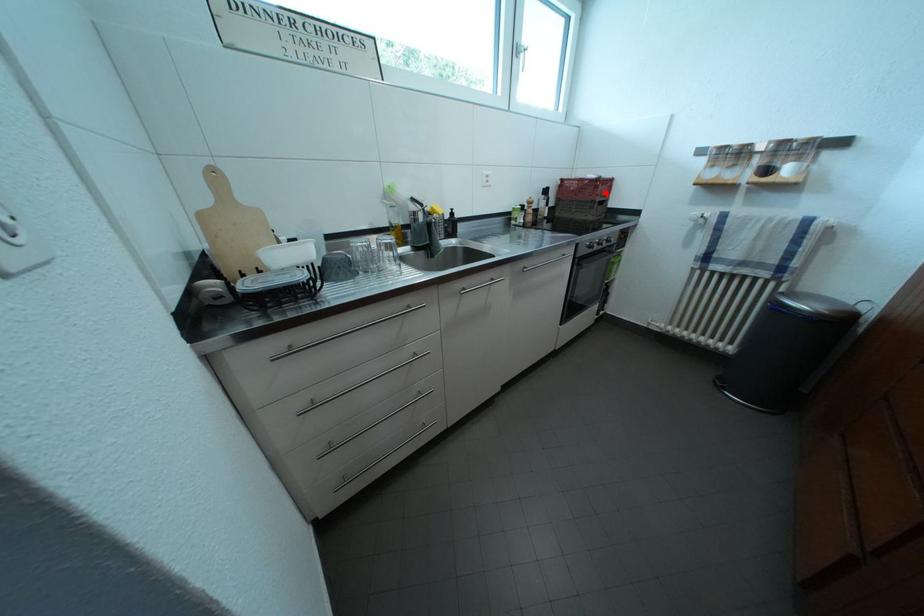
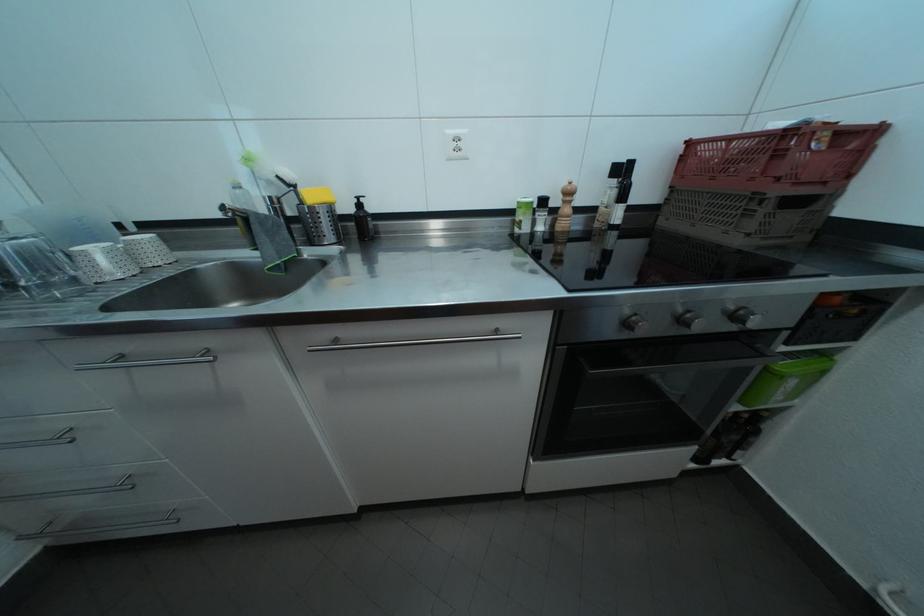
Where in the second image is the point corresponding to the highlighted location from the first image?

(787, 161)